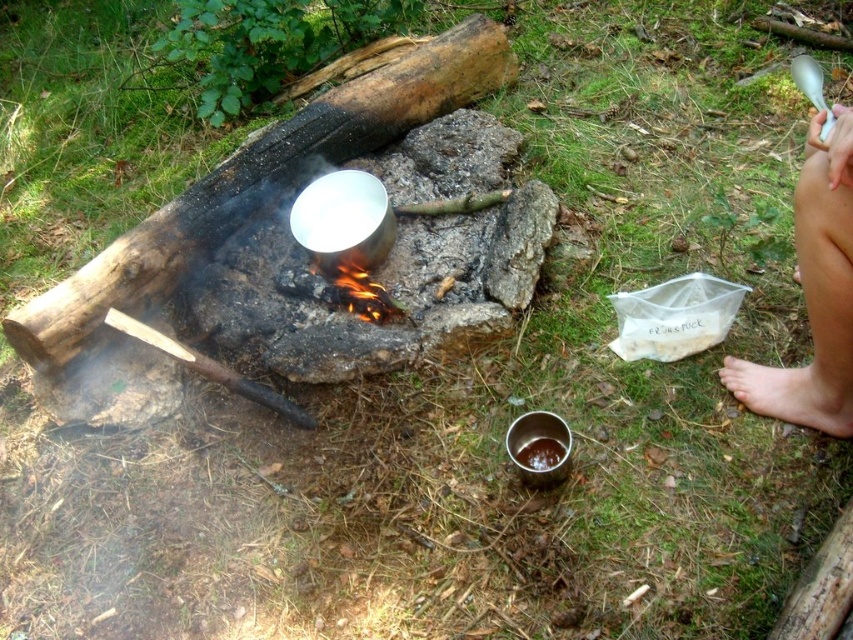
You are a hiker who just finished setting up camp. You want to check if your bare skin leg at right is within a safe distance from the fire pit to avoid burns. The recommended safe distance is 1.2 meters. Is your leg within the safe zone?

The bare skin leg at right is 1.14 meters away from the camera, which is closer than the recommended 1.2 meters safe distance. Therefore, your leg is outside the safe zone and at risk of burns.

You are a hiker who just arrived at the campsite. You notice two areas of bare skin. The first is the bare skin leg at right, and the second is the bare skin at lower right. Which of these two areas is closer to the fire pit?

The bare skin leg at right is positioned over the bare skin at lower right, meaning it is closer to the fire pit.

You are a hiker preparing to cook a meal. You have two bare skin areas exposed to the fire pit. Which area is wider? The bare skin leg at right or the bare skin at lower right?

The bare skin leg at right is wider than the bare skin at lower right.